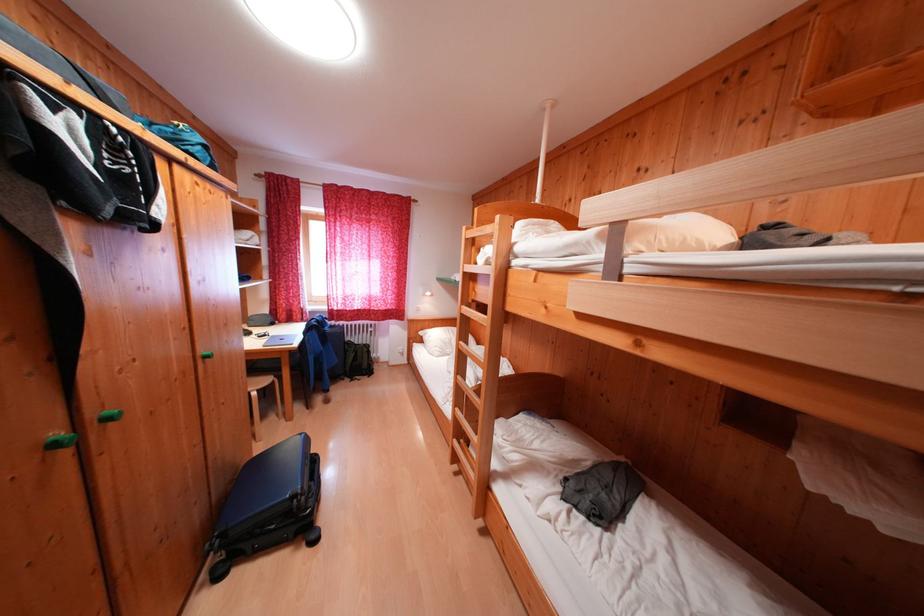
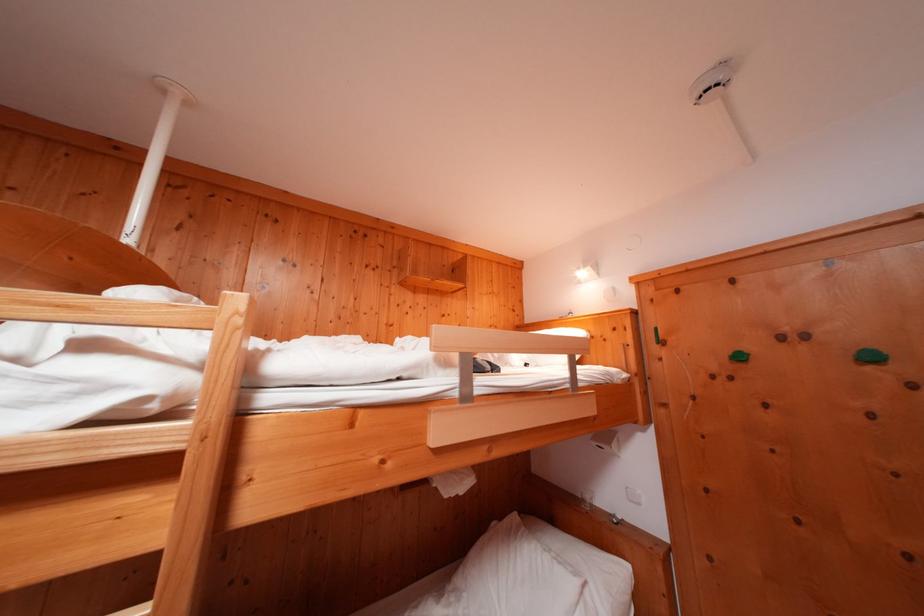
Question: Based on the continuous images, in which direction is the camera rotating? Reply with the corresponding letter.

Choices:
 (A) Left
 (B) Right
 (C) Up
 (D) Down

Answer: (B)